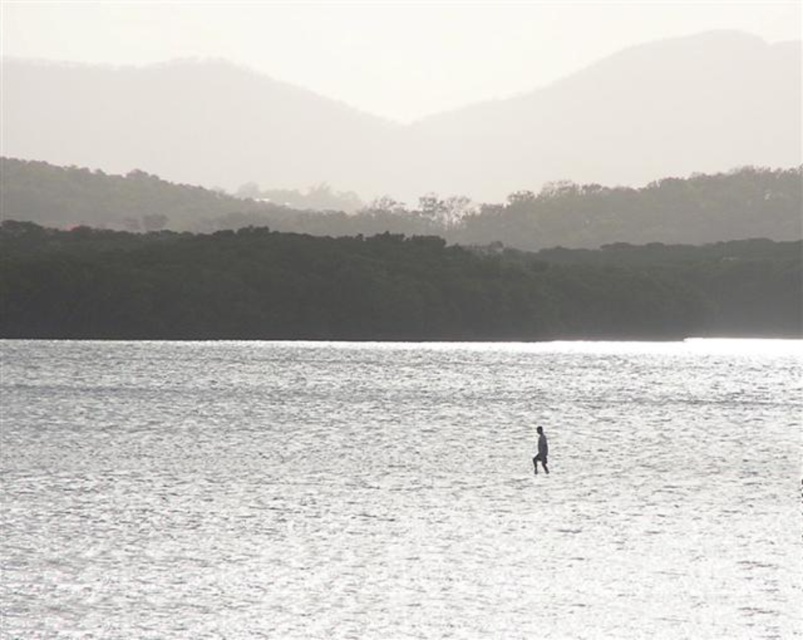
Question: Is clear water at center bigger than smooth skin figure at center?

Choices:
 (A) no
 (B) yes

Answer: (B)

Question: Does clear water at center have a lesser width compared to smooth skin figure at center?

Choices:
 (A) yes
 (B) no

Answer: (B)

Question: Which point is closer to the camera taking this photo?

Choices:
 (A) (310, 442)
 (B) (545, 468)

Answer: (B)

Question: Which object appears farthest from the camera in this image?

Choices:
 (A) clear water at center
 (B) smooth skin figure at center

Answer: (B)

Question: Does clear water at center appear under smooth skin figure at center?

Choices:
 (A) no
 (B) yes

Answer: (A)